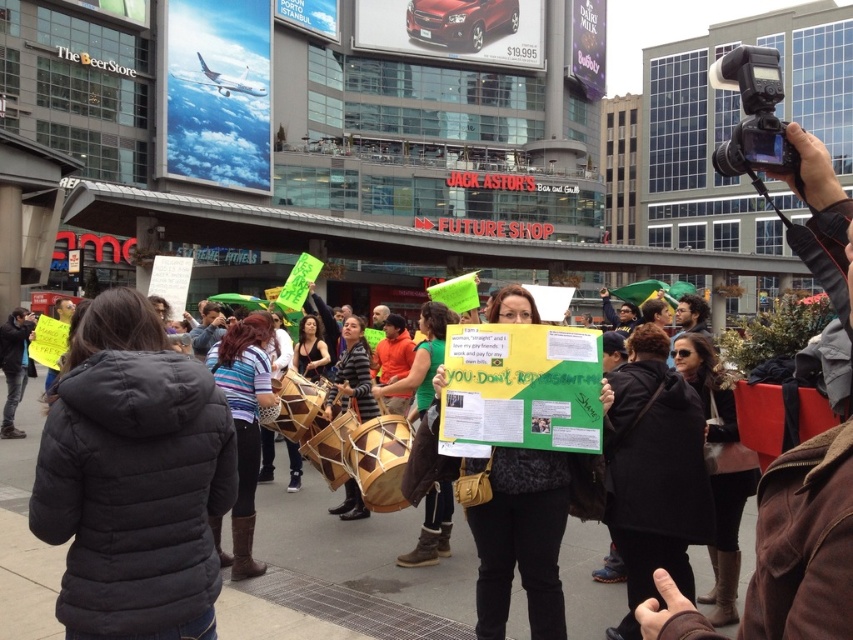
Can you confirm if green paper sign at center is thinner than black plastic camera at upper right?

Indeed, green paper sign at center has a lesser width compared to black plastic camera at upper right.

Between green paper sign at center and black plastic camera at upper right, which one appears on the right side from the viewer's perspective?

black plastic camera at upper right

At what (x,y) coordinates should I click in order to perform the action: click on green paper sign at center. Please return your answer as a coordinate pair (x, y). Looking at the image, I should click on (521, 538).